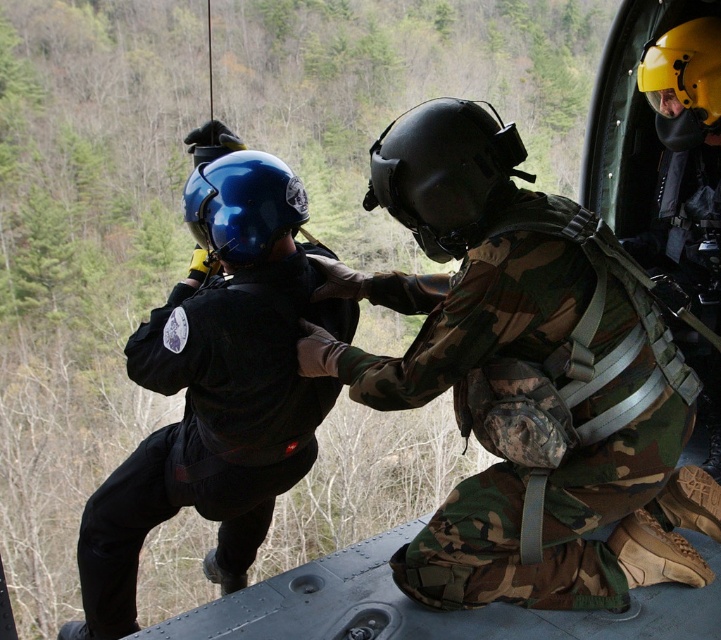
Question: Does camo fabric helmet at center appear under matte black helmet at left?

Choices:
 (A) no
 (B) yes

Answer: (A)

Question: Estimate the real-world distances between objects in this image. Which object is closer to the camo fabric helmet at center?

Choices:
 (A) black matte helmet at center
 (B) matte black helmet at left
 (C) glossy blue helmet at center

Answer: (A)

Question: Which of the following is the farthest from the observer?

Choices:
 (A) matte black helmet at left
 (B) black matte helmet at center
 (C) yellow matte helmet at upper right

Answer: (C)

Question: Where is matte black helmet at left located in relation to glossy blue helmet at center in the image?

Choices:
 (A) left
 (B) right

Answer: (A)

Question: Among these points, which one is nearest to the camera?

Choices:
 (A) (234, 289)
 (B) (698, 115)
 (C) (508, 147)

Answer: (C)

Question: Is black matte helmet at center thinner than glossy blue helmet at center?

Choices:
 (A) no
 (B) yes

Answer: (A)